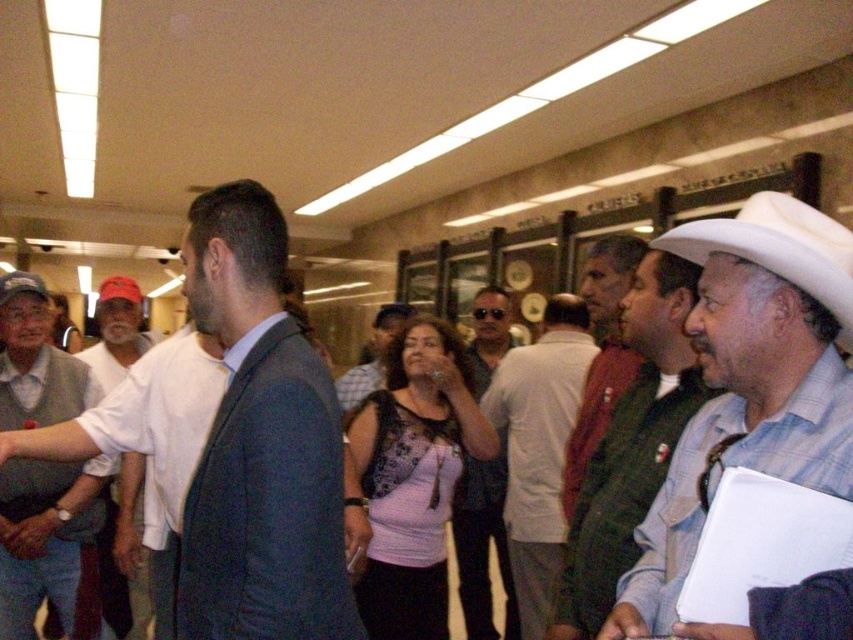
Question: Which of the following is the farthest from the observer?

Choices:
 (A) (78, 532)
 (B) (393, 324)
 (C) (817, 272)

Answer: (B)

Question: Considering the real-world distances, which object is closest to the light brown vest at left?

Choices:
 (A) light pink fabric shirt at center
 (B) white matte hat at right
 (C) matte pink blouse at center
 (D) white cotton shirt at left

Answer: (D)

Question: Estimate the real-world distances between objects in this image. Which object is farther from the light brown vest at left?

Choices:
 (A) matte gray shirt at center
 (B) matte pink blouse at center

Answer: (A)

Question: Does white matte hat at right appear under light blue shirt at center?

Choices:
 (A) yes
 (B) no

Answer: (B)

Question: Does white felt cowboy hat at right have a lesser width compared to white cotton shirt at left?

Choices:
 (A) no
 (B) yes

Answer: (A)

Question: Is light blue shirt at center closer to the viewer compared to matte pink blouse at center?

Choices:
 (A) yes
 (B) no

Answer: (A)